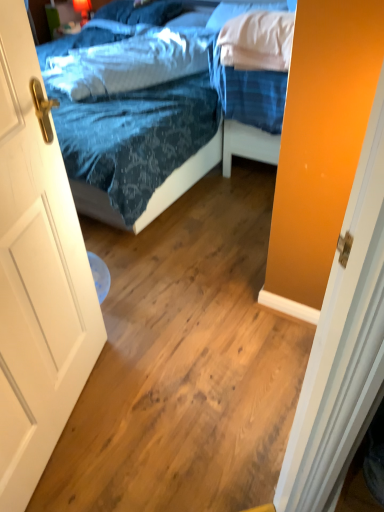
Question: Considering their positions, is white wooden door at left located in front of or behind blue fabric pillow at upper center, which is the 1th pillow in back-to-front order?

Choices:
 (A) behind
 (B) front

Answer: (B)

Question: Is point (8, 109) positioned closer to the camera than point (107, 4)?

Choices:
 (A) farther
 (B) closer

Answer: (B)

Question: Which object is positioned farthest from the white wooden door at left?

Choices:
 (A) blue fabric pillow at upper center, which is the 1th pillow in back-to-front order
 (B) blue fabric bed at upper right
 (C) white soft pillow at upper right, which appears as the second pillow when viewed from the back
 (D) blue textured pillow at upper center, the 3th pillow from the back

Answer: (A)

Question: Which object is the farthest from the blue fabric pillow at upper center, arranged as the third pillow when viewed from the front?

Choices:
 (A) white wooden door at left
 (B) blue fabric bed at upper right
 (C) white soft pillow at upper right, which is the 2th pillow in front-to-back order
 (D) blue textured pillow at upper center, which is counted as the 1th pillow, starting from the front

Answer: (A)